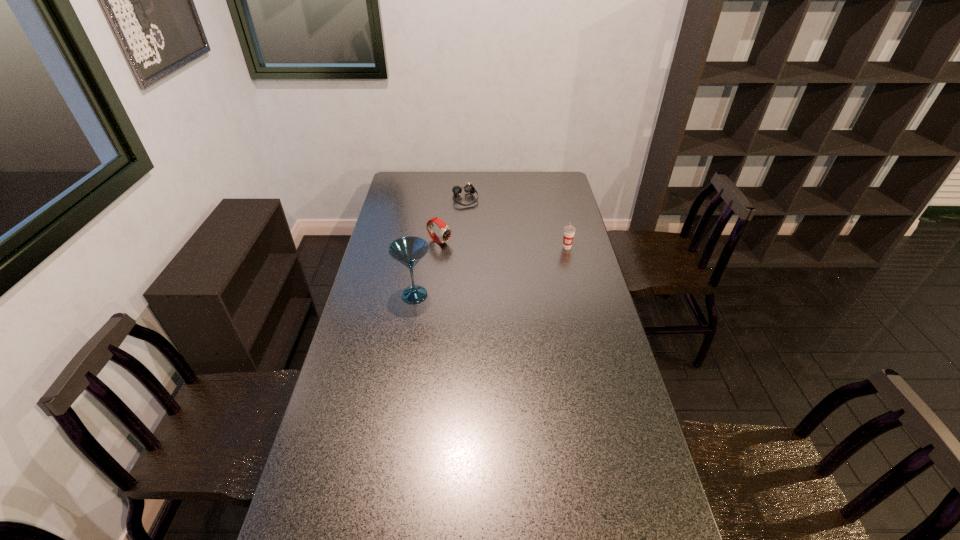
Where is `vacant space on the desktop that is between the nearest object and the rightmost object and is positioned through the lenses of the shortest object`? vacant space on the desktop that is between the nearest object and the rightmost object and is positioned through the lenses of the shortest object is located at coordinates (500, 268).

Identify the location of vacant space on the desktop that is between the tallest object and the cup and is positioned on the face of the watch. (492, 271).